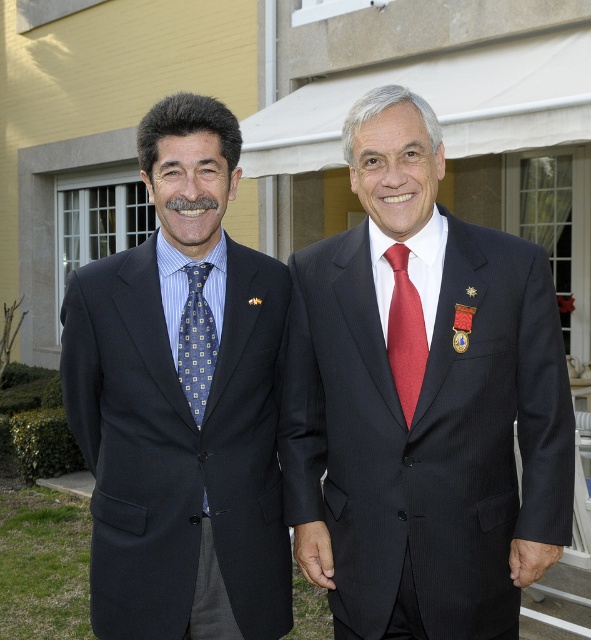
Between dark pinstripe suit at center and shiny red tie at center, which one appears on the right side from the viewer's perspective?

dark pinstripe suit at center is more to the right.

Which is below, dark pinstripe suit at center or shiny red tie at center?

dark pinstripe suit at center

Is point (345, 291) more distant than point (394, 259)?

Yes, it is behind point (394, 259).

Identify the location of dark pinstripe suit at center. (427, 429).

Between dark pinstripe suit at center and blue patterned tie at left, which one appears on the left side from the viewer's perspective?

Positioned to the left is blue patterned tie at left.

Which is above, dark pinstripe suit at center or blue patterned tie at left?

blue patterned tie at left

Is point (314, 435) behind point (196, 330)?

Yes, point (314, 435) is behind point (196, 330).

This screenshot has height=640, width=591. I want to click on dark pinstripe suit at center, so click(x=427, y=429).

Who is lower down, blue textured suit at left or shiny red tie at center?

blue textured suit at left is lower down.

Is blue textured suit at left positioned at the back of shiny red tie at center?

Yes, it is behind shiny red tie at center.

Which is in front, point (111, 499) or point (404, 339)?

Point (404, 339) is more forward.

The height and width of the screenshot is (640, 591). What are the coordinates of `blue textured suit at left` in the screenshot? It's located at (181, 401).